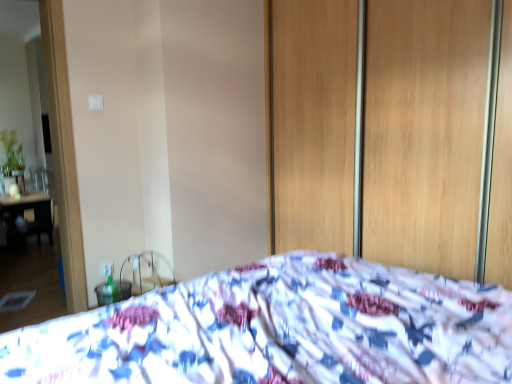
Image resolution: width=512 pixels, height=384 pixels. Describe the element at coordinates (424, 132) in the screenshot. I see `wooden screen door at center` at that location.

Locate an element on the screen. The image size is (512, 384). wooden screen door at center is located at coordinates (424, 132).

In order to face wooden screen door at center, should I rotate leftwards or rightwards?

Rotate right and turn 14.504 degrees.

You are a GUI agent. You are given a task and a screenshot of the screen. Output one action in this format:
    pyautogui.click(x=<x>, y=<y>)
    Task: Click on the white printed fabric bed at center
    
    Given the screenshot: What is the action you would take?
    pyautogui.click(x=279, y=330)

The width and height of the screenshot is (512, 384). What do you see at coordinates (279, 330) in the screenshot?
I see `white printed fabric bed at center` at bounding box center [279, 330].

What is the approximate width of white printed fabric bed at center?

The width of white printed fabric bed at center is 4.19 feet.

In order to click on wooden screen door at center in this screenshot , I will do `click(424, 132)`.

Considering the positions of objects wooden screen door at center and white printed fabric bed at center in the image provided, who is more to the right, wooden screen door at center or white printed fabric bed at center?

wooden screen door at center is more to the right.

Between wooden screen door at center and white printed fabric bed at center, which one is positioned behind?

wooden screen door at center is further away from the camera.

Between point (281, 159) and point (134, 332), which one is positioned in front?

Point (134, 332)

From the image's perspective, is wooden screen door at center positioned above or below white printed fabric bed at center?

wooden screen door at center is situated higher than white printed fabric bed at center in the image.

From a real-world perspective, does wooden screen door at center stand above white printed fabric bed at center?

Yes.

In the scene shown: Which of these two, wooden screen door at center or white printed fabric bed at center, is wider?

Wider between the two is white printed fabric bed at center.

Does wooden screen door at center have a lesser height compared to white printed fabric bed at center?

No.

Between wooden screen door at center and white printed fabric bed at center, which one has smaller size?

With smaller size is wooden screen door at center.

Is white printed fabric bed at center inside wooden screen door at center?

No, white printed fabric bed at center is located outside of wooden screen door at center.

Is wooden screen door at center next to white printed fabric bed at center?

wooden screen door at center is not next to white printed fabric bed at center, and they're not touching.

Is white printed fabric bed at center at the back of wooden screen door at center?

No, white printed fabric bed at center is not at the back of wooden screen door at center.

Measure the distance from wooden screen door at center to white printed fabric bed at center.

wooden screen door at center is 3.69 feet away from white printed fabric bed at center.

I want to click on bed below the wooden screen door at center (from a real-world perspective), so tap(279, 330).

In the image, is white printed fabric bed at center on the left side or the right side of wooden screen door at center?

white printed fabric bed at center is positioned on wooden screen door at center's left side.

Between white printed fabric bed at center and wooden screen door at center, which one is positioned in front?

white printed fabric bed at center is more forward.

Is point (215, 322) positioned before point (510, 190)?

Yes, it is in front of point (510, 190).

From the image's perspective, is white printed fabric bed at center over wooden screen door at center?

No.

From a real-world perspective, which is physically above, white printed fabric bed at center or wooden screen door at center?

In real-world perspective, wooden screen door at center is above.

Can you confirm if white printed fabric bed at center is thinner than wooden screen door at center?

No, white printed fabric bed at center is not thinner than wooden screen door at center.

Considering the sizes of objects white printed fabric bed at center and wooden screen door at center in the image provided, who is shorter, white printed fabric bed at center or wooden screen door at center?

white printed fabric bed at center.

Does white printed fabric bed at center have a larger size compared to wooden screen door at center?

Yes.

Is white printed fabric bed at center not inside wooden screen door at center?

Yes.

Is white printed fabric bed at center in contact with wooden screen door at center?

No.

Is white printed fabric bed at center aimed at wooden screen door at center?

No, white printed fabric bed at center is not oriented towards wooden screen door at center.

How many degrees apart are the facing directions of white printed fabric bed at center and wooden screen door at center?

89.9 degrees.

I want to click on bed below the wooden screen door at center (from the image's perspective), so click(x=279, y=330).

What are the coordinates of `bed below the wooden screen door at center (from a real-world perspective)` in the screenshot? It's located at (279, 330).

Locate an element on the screen. Image resolution: width=512 pixels, height=384 pixels. screen door on the right of white printed fabric bed at center is located at coordinates (424, 132).